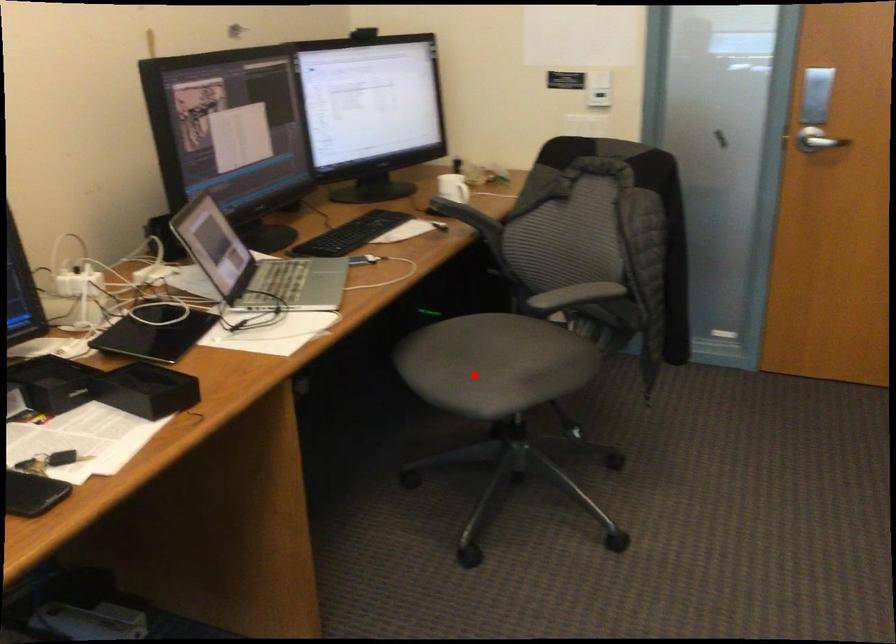
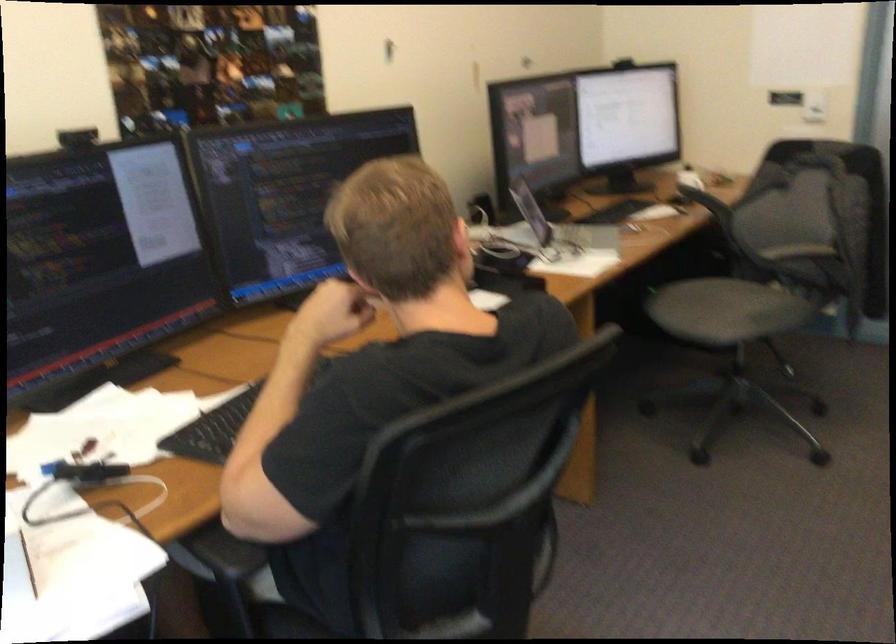
The point at the highlighted location is marked in the first image. Where is the corresponding point in the second image?

(709, 308)